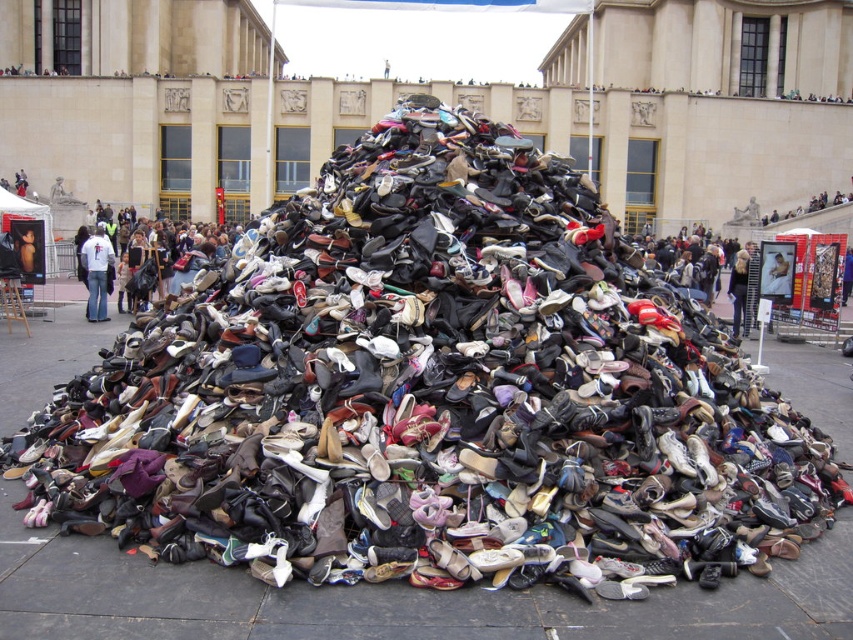
Question: Which object appears closest to the camera in this image?

Choices:
 (A) dark blue jeans at center
 (B) light blue jeans at center

Answer: (A)

Question: Can you confirm if white cotton shirt at center is positioned to the left of dark blue jeans at center?

Choices:
 (A) no
 (B) yes

Answer: (B)

Question: Which object appears farthest from the camera in this image?

Choices:
 (A) denim jacket at center
 (B) smooth skin face at center
 (C) light blue jeans at center
 (D) white cotton shirt at center

Answer: (A)

Question: Is white cotton shirt at center closer to the viewer compared to dark blue jeans at center?

Choices:
 (A) yes
 (B) no

Answer: (B)

Question: Which of these objects is positioned farthest from the light blue jeans at center?

Choices:
 (A) white cotton shirt at center
 (B) dark blue jeans at center
 (C) smooth skin face at center
 (D) denim jacket at center

Answer: (C)

Question: Is white cotton shirt at center wider than smooth skin face at center?

Choices:
 (A) no
 (B) yes

Answer: (B)